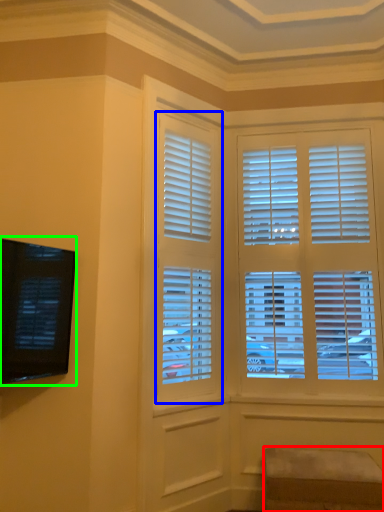
Question: Based on their relative distances, which object is farther from furniture (highlighted by a red box)? Choose from window (highlighted by a blue box) and window screen (highlighted by a green box).

Choices:
 (A) window
 (B) window screen

Answer: (B)